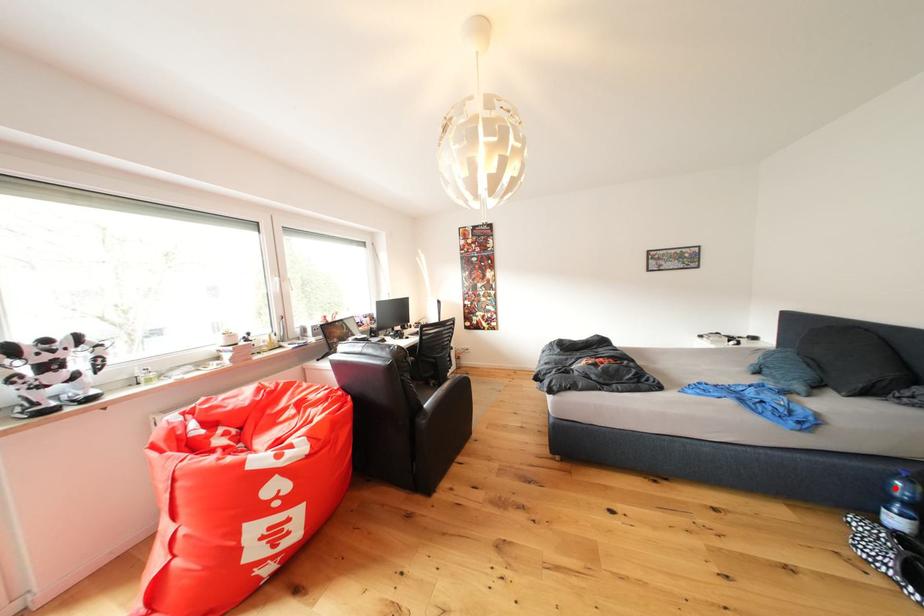
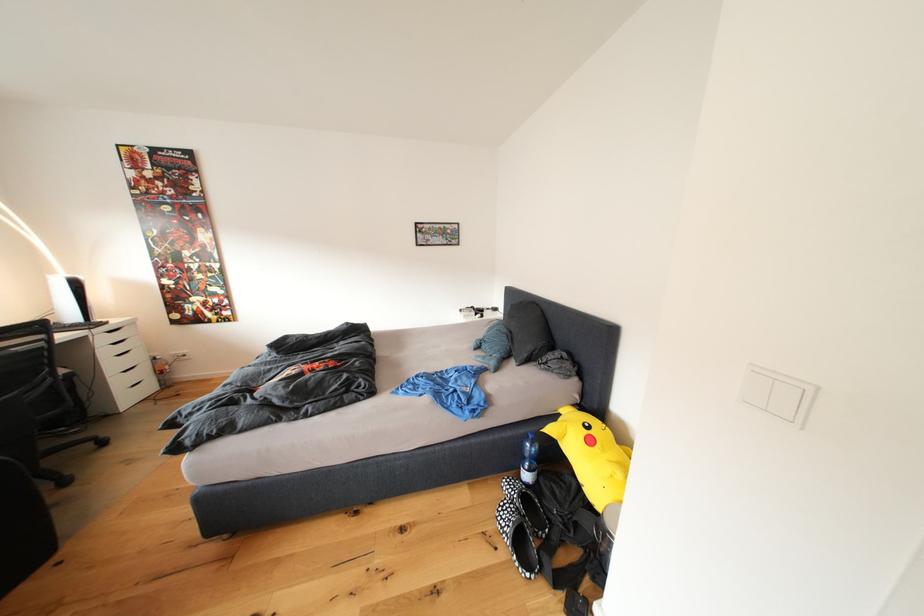
The point at the highlighted location is marked in the first image. Where is the corresponding point in the second image?

(531, 451)